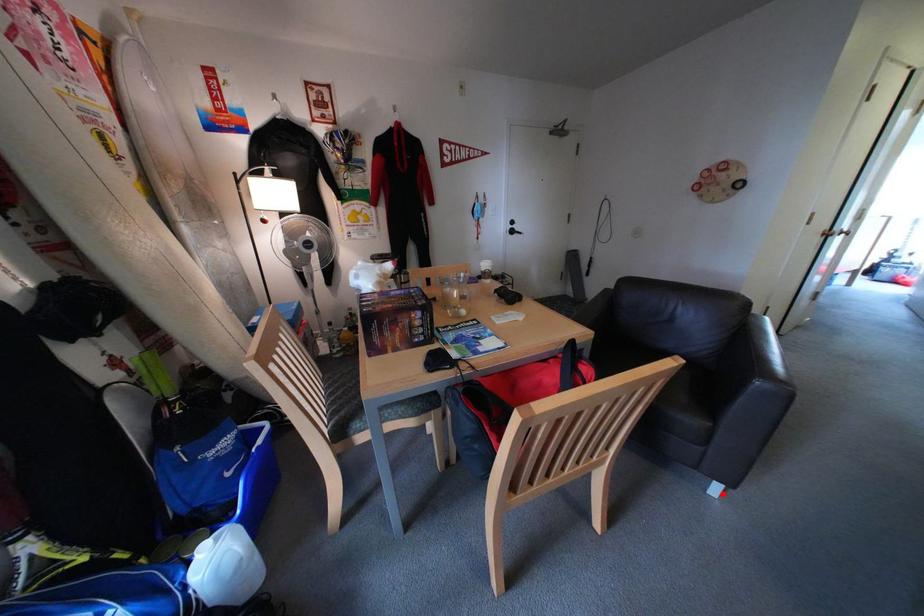
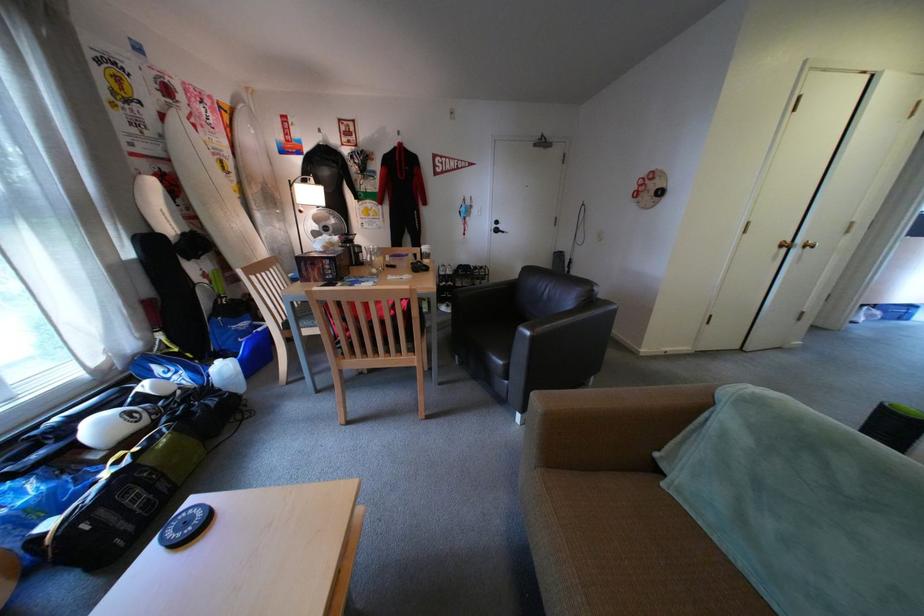
The point at the highlighted location is marked in the first image. Where is the corresponding point in the second image?

(530, 422)